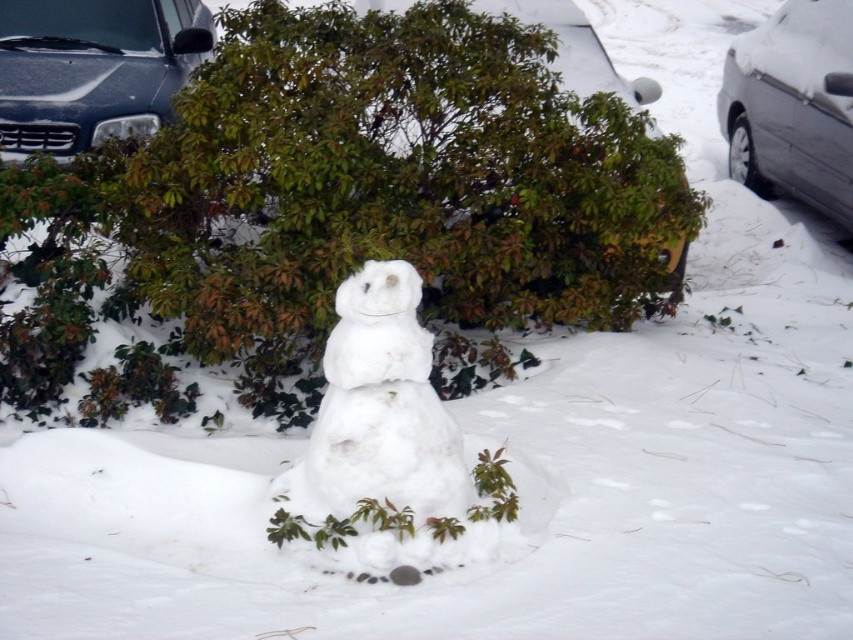
You are a delivery person who needs to park your car, which is 15 feet long, between the white fluffy snowman at center and the sleek silver sedan at right. Is there enough space for your car?

The distance between the white fluffy snowman at center and the sleek silver sedan at right is 18.39 feet. Since your car is 15 feet long, there is enough space to park between them.